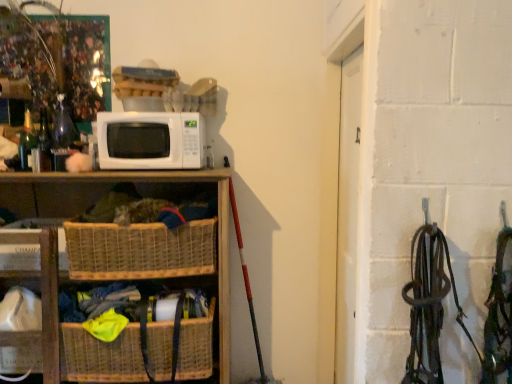
Question: Is green glass bottle at left positioned before woven brown basket at lower left, which is the 2th basket from bottom to top?

Choices:
 (A) yes
 (B) no

Answer: (B)

Question: Can you confirm if green glass bottle at left is positioned to the right of woven brown basket at lower left, which is the first basket in top-to-bottom order?

Choices:
 (A) no
 (B) yes

Answer: (A)

Question: Is green glass bottle at left at the left side of woven brown basket at lower left, which is the 2th basket from bottom to top?

Choices:
 (A) no
 (B) yes

Answer: (B)

Question: Is green glass bottle at left positioned beyond the bounds of woven brown basket at lower left, which is the first basket in top-to-bottom order?

Choices:
 (A) yes
 (B) no

Answer: (A)

Question: Are green glass bottle at left and woven brown basket at lower left, which is the 2th basket from bottom to top, making contact?

Choices:
 (A) yes
 (B) no

Answer: (B)

Question: Is woven brown basket at lower left, which is the first basket in top-to-bottom order, at the back of green glass bottle at left?

Choices:
 (A) no
 (B) yes

Answer: (A)

Question: Does woven brown basket at lower center, the 1th basket from the bottom, turn towards woven wood shelf at lower left, which is the first shelf from right to left?

Choices:
 (A) yes
 (B) no

Answer: (A)

Question: Is woven brown basket at lower center, marked as the 2th basket in a top-to-bottom arrangement, positioned in front of woven wood shelf at lower left, which ranks as the 2th shelf in left-to-right order?

Choices:
 (A) yes
 (B) no

Answer: (B)

Question: Is woven brown basket at lower center, marked as the 2th basket in a top-to-bottom arrangement, surrounding woven wood shelf at lower left, which is the first shelf from right to left?

Choices:
 (A) yes
 (B) no

Answer: (B)

Question: Is woven brown basket at lower center, the 1th basket from the bottom, turned away from woven wood shelf at lower left, which ranks as the 2th shelf in left-to-right order?

Choices:
 (A) yes
 (B) no

Answer: (A)

Question: From a real-world perspective, is woven brown basket at lower center, marked as the 2th basket in a top-to-bottom arrangement, on woven wood shelf at lower left, which is the first shelf from right to left?

Choices:
 (A) no
 (B) yes

Answer: (A)

Question: Does woven brown basket at lower center, the 1th basket from the bottom, have a greater width compared to woven wood shelf at lower left, which is the first shelf from right to left?

Choices:
 (A) yes
 (B) no

Answer: (A)

Question: Considering the relative sizes of woven wood shelf at lower left, which is the first shelf from right to left, and white matte microwave at center in the image provided, is woven wood shelf at lower left, which is the first shelf from right to left, shorter than white matte microwave at center?

Choices:
 (A) no
 (B) yes

Answer: (A)